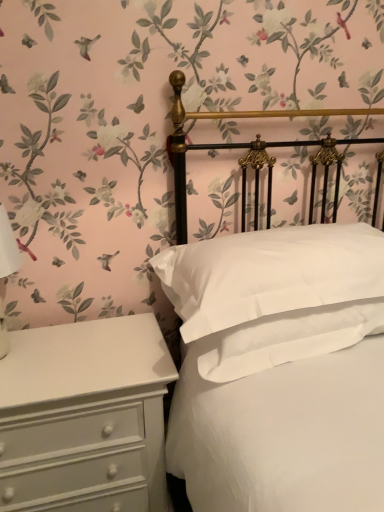
Image resolution: width=384 pixels, height=512 pixels. Find the location of `white painted wood chest of drawers at lower left`. white painted wood chest of drawers at lower left is located at coordinates (85, 417).

This screenshot has width=384, height=512. Describe the element at coordinates (235, 143) in the screenshot. I see `white matte bed at center` at that location.

At what (x,y) coordinates should I click in order to perform the action: click on white painted wood chest of drawers at lower left. Please return your answer as a coordinate pair (x, y). Looking at the image, I should click on 85,417.

From a real-world perspective, which is physically above, white matte bed at center or white smooth pillow at center?

white smooth pillow at center.

Does point (259, 144) come behind point (243, 278)?

Yes, point (259, 144) is behind point (243, 278).

Considering the relative sizes of white matte bed at center and white smooth pillow at center in the image provided, is white matte bed at center shorter than white smooth pillow at center?

Incorrect, the height of white matte bed at center does not fall short of that of white smooth pillow at center.

Is white matte bed at center not within white smooth pillow at center?

Yes, white matte bed at center is located beyond the bounds of white smooth pillow at center.

In the scene shown: From a real-world perspective, which is physically below, white painted wood chest of drawers at lower left or white matte bed at center?

From a 3D spatial view, white painted wood chest of drawers at lower left is below.

This screenshot has width=384, height=512. I want to click on bed above the white painted wood chest of drawers at lower left (from a real-world perspective), so click(x=235, y=143).

Between white smooth pillow at center and white painted wood chest of drawers at lower left, which one is positioned in front?

white smooth pillow at center is closer to the camera.

Which is less distant, (333, 287) or (7, 403)?

The point (7, 403) is closer.

From the image's perspective, which one is positioned higher, white smooth pillow at center or white painted wood chest of drawers at lower left?

white smooth pillow at center appears higher in the image.

Who is more distant, white painted wood chest of drawers at lower left or white smooth pillow at center?

white painted wood chest of drawers at lower left is further from the camera.

Is white painted wood chest of drawers at lower left looking in the opposite direction of white smooth pillow at center?

No, white painted wood chest of drawers at lower left is not facing away from white smooth pillow at center.

Considering the sizes of white painted wood chest of drawers at lower left and white smooth pillow at center in the image, is white painted wood chest of drawers at lower left taller or shorter than white smooth pillow at center?

white painted wood chest of drawers at lower left is taller than white smooth pillow at center.

The height and width of the screenshot is (512, 384). I want to click on the chest of drawers that is below the white smooth pillow at center (from the image's perspective), so click(85, 417).

Can we say white smooth pillow at center lies outside white matte bed at center?

No, white smooth pillow at center is inside white matte bed at center's boundary.

Can you confirm if white smooth pillow at center is smaller than white matte bed at center?

Yes, white smooth pillow at center is smaller than white matte bed at center.

Is white smooth pillow at center placed right next to white matte bed at center?

white smooth pillow at center and white matte bed at center are clearly separated.

Between point (318, 295) and point (298, 142), which one is positioned in front?

The point (318, 295) is closer to the camera.

Considering the sizes of objects white matte bed at center and white painted wood chest of drawers at lower left in the image provided, who is taller, white matte bed at center or white painted wood chest of drawers at lower left?

Standing taller between the two is white matte bed at center.

Is white matte bed at center bigger or smaller than white painted wood chest of drawers at lower left?

Clearly, white matte bed at center is larger in size than white painted wood chest of drawers at lower left.

Identify the location of the chest of drawers located behind the white matte bed at center. (85, 417).

Find the location of a particular element. The width and height of the screenshot is (384, 512). bed that is on the right side of white smooth pillow at center is located at coordinates (235, 143).

You are a GUI agent. You are given a task and a screenshot of the screen. Output one action in this format:
    pyautogui.click(x=<x>, y=<y>)
    Task: Click on the chest of drawers on the left of white matte bed at center
    This screenshot has width=384, height=512.
    Given the screenshot: What is the action you would take?
    pyautogui.click(x=85, y=417)

Looking at the image, which one is located closer to white painted wood chest of drawers at lower left, white smooth pillow at center or white matte bed at center?

white smooth pillow at center.

When comparing their distances from white smooth pillow at center, does white painted wood chest of drawers at lower left or white matte bed at center seem closer?

Among the two, white matte bed at center is located nearer to white smooth pillow at center.

Considering their positions, is white painted wood chest of drawers at lower left positioned further to white matte bed at center than white smooth pillow at center?

white painted wood chest of drawers at lower left lies further to white matte bed at center than the other object.

Looking at the image, which one is located closer to white painted wood chest of drawers at lower left, white matte bed at center or white smooth pillow at center?

The object closer to white painted wood chest of drawers at lower left is white smooth pillow at center.

Looking at the image, which one is located further to white smooth pillow at center, white matte bed at center or white painted wood chest of drawers at lower left?

white painted wood chest of drawers at lower left is further to white smooth pillow at center.

From the image, which object appears to be farther from white matte bed at center, white smooth pillow at center or white painted wood chest of drawers at lower left?

The object further to white matte bed at center is white painted wood chest of drawers at lower left.

The height and width of the screenshot is (512, 384). I want to click on pillow between white matte bed at center and white painted wood chest of drawers at lower left in the front-back direction, so click(x=269, y=274).